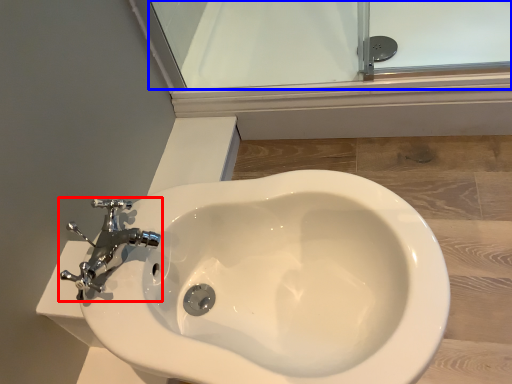
Question: Among these objects, which one is nearest to the camera, tap (highlighted by a red box) or glass door (highlighted by a blue box)?

Choices:
 (A) tap
 (B) glass door

Answer: (A)